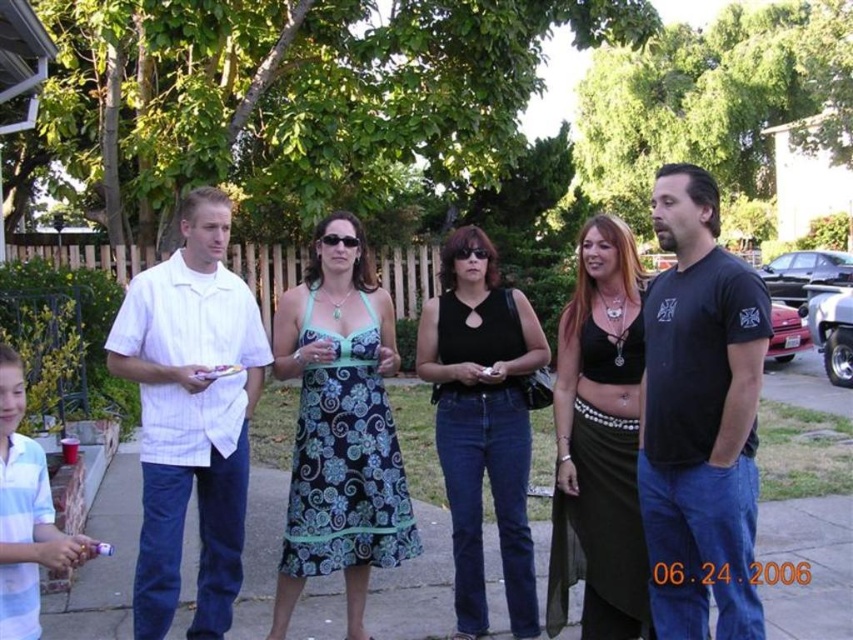
Question: Based on their relative distances, which object is farther from the white striped shirt at left?

Choices:
 (A) floral-patterned dress at center
 (B) black sheer skirt at center
 (C) black cotton t-shirt at right
 (D) black matte tank top at center

Answer: (C)

Question: Can you confirm if floral-patterned dress at center is thinner than black matte tank top at center?

Choices:
 (A) no
 (B) yes

Answer: (A)

Question: Which point appears farthest from the camera in this image?

Choices:
 (A) coord(291,289)
 (B) coord(210,280)

Answer: (A)

Question: Which point is closer to the camera taking this photo?

Choices:
 (A) (622, 490)
 (B) (273, 609)
 (C) (218, 289)
 (D) (514, 561)

Answer: (A)

Question: Is white striped shirt at left positioned behind floral-patterned dress at center?

Choices:
 (A) yes
 (B) no

Answer: (B)

Question: Can you confirm if black cotton t-shirt at right is bigger than floral-patterned dress at center?

Choices:
 (A) no
 (B) yes

Answer: (A)